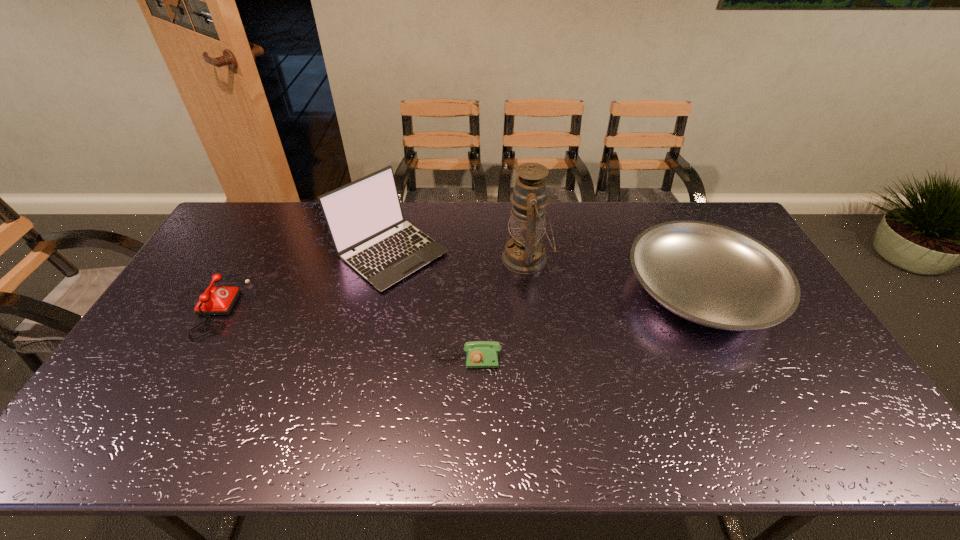
I want to click on free space at the left edge of the desktop, so coord(188,281).

The image size is (960, 540). In the image, there is a desktop. Identify the location of free space at the right edge. (789, 394).

At what (x,y) coordinates should I click in order to perform the action: click on blank space at the far left corner of the desktop. Please return your answer as a coordinate pair (x, y). This screenshot has height=540, width=960. Looking at the image, I should click on (278, 210).

The image size is (960, 540). I want to click on empty space that is in between the left telephone and the right telephone, so pos(336,330).

The image size is (960, 540). Find the location of `vacant area that lies between the shortest object and the leftmost object`. vacant area that lies between the shortest object and the leftmost object is located at coordinates (336, 330).

Image resolution: width=960 pixels, height=540 pixels. I want to click on unoccupied position between the tallest object and the nearer telephone, so click(x=496, y=308).

You are a GUI agent. You are given a task and a screenshot of the screen. Output one action in this format:
    pyautogui.click(x=<x>, y=<y>)
    Task: Click on the vacant point located between the oil lamp and the leftmost object
    
    Given the screenshot: What is the action you would take?
    pyautogui.click(x=367, y=281)

Identify the location of free spot between the second tallest object and the tallest object. The height and width of the screenshot is (540, 960). (459, 256).

Where is `empty location between the rightmost object and the left telephone`? The width and height of the screenshot is (960, 540). empty location between the rightmost object and the left telephone is located at coordinates (454, 297).

The height and width of the screenshot is (540, 960). I want to click on free point between the oil lamp and the bedpan, so click(613, 274).